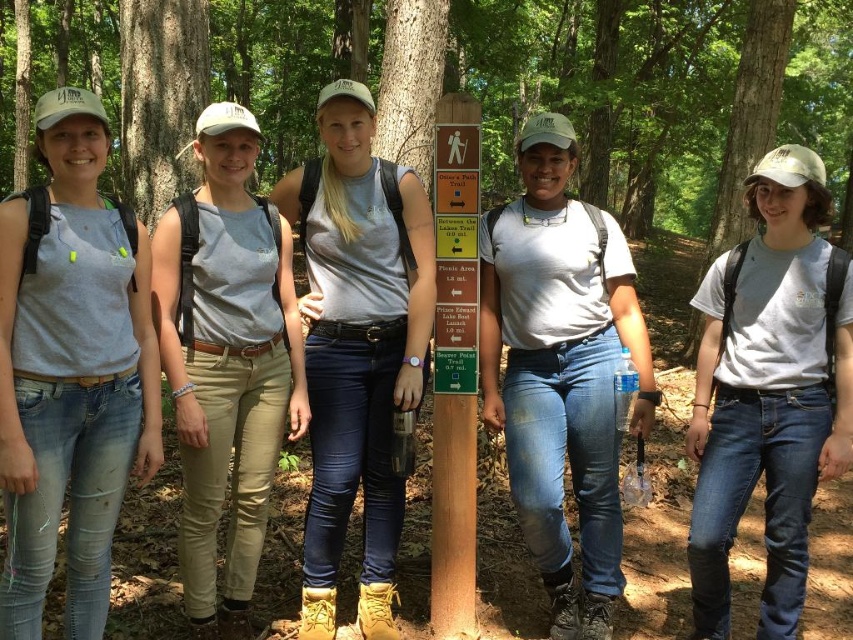
Question: Can you confirm if blue jeans at center is positioned to the left of white cotton t-shirt at center?

Choices:
 (A) yes
 (B) no

Answer: (A)

Question: Which point is farther to the camera?

Choices:
 (A) (379, 586)
 (B) (24, 593)
 (C) (720, 474)

Answer: (A)

Question: Considering the relative positions of blue jeans at center and matte gray shirt at center in the image provided, where is blue jeans at center located with respect to matte gray shirt at center?

Choices:
 (A) above
 (B) below

Answer: (B)

Question: Does matte gray tank top at left have a greater width compared to white cotton t-shirt at center?

Choices:
 (A) yes
 (B) no

Answer: (B)

Question: Which of these objects is positioned farthest from the white cotton t-shirt at center?

Choices:
 (A) light beige cotton pants at center
 (B) matte gray tank top at left
 (C) blue jeans at center
 (D) matte gray shirt at center

Answer: (B)

Question: Which object is positioned farthest from the blue jeans at center?

Choices:
 (A) matte gray shirt at center
 (B) light beige cotton pants at center
 (C) white cotton t-shirt at center
 (D) matte gray tank top at left

Answer: (D)